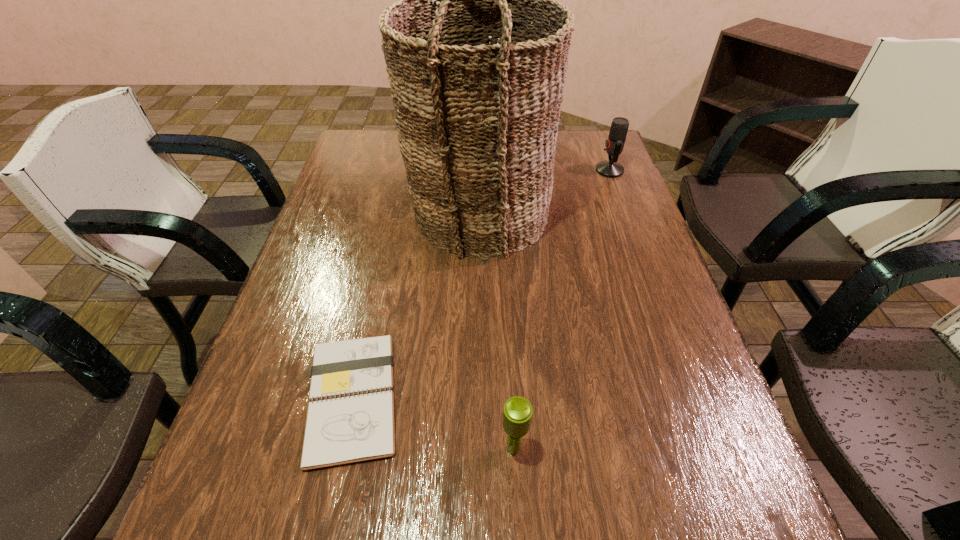
Find the location of a particular element. This screenshot has width=960, height=540. the tallest object is located at coordinates (477, 122).

Locate an element on the screen. The image size is (960, 540). the rightmost object is located at coordinates (614, 144).

The image size is (960, 540). What are the coordinates of `the right microphone` in the screenshot? It's located at (614, 144).

Where is `the left microphone`? the left microphone is located at coordinates (517, 414).

At what (x,y) coordinates should I click in order to perform the action: click on the shortest object. Please return your answer as a coordinate pair (x, y). The height and width of the screenshot is (540, 960). Looking at the image, I should click on (351, 417).

I want to click on vacant region located 0.340m on the front of the basket, so click(x=477, y=385).

You are a GUI agent. You are given a task and a screenshot of the screen. Output one action in this format:
    pyautogui.click(x=<x>, y=<y>)
    Task: Click on the free space located on the side of the rightmost object with the red ring
    This screenshot has height=540, width=960.
    Given the screenshot: What is the action you would take?
    pyautogui.click(x=524, y=170)

Identify the location of vacant area situated 0.060m on the side of the rightmost object with the red ring. The width and height of the screenshot is (960, 540). (577, 170).

Find the location of `vacant space located on the side of the rightmost object with the red ring`. vacant space located on the side of the rightmost object with the red ring is located at coordinates (477, 170).

Image resolution: width=960 pixels, height=540 pixels. In order to click on free region located on the back of the left microphone in this screenshot , I will do `click(508, 342)`.